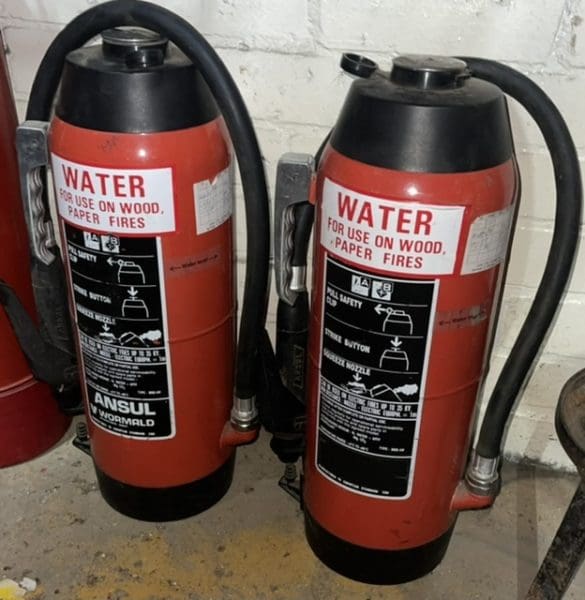
Locate an element on the screen. The image size is (585, 600). fire extinguisher tube is located at coordinates (227, 88), (558, 144).